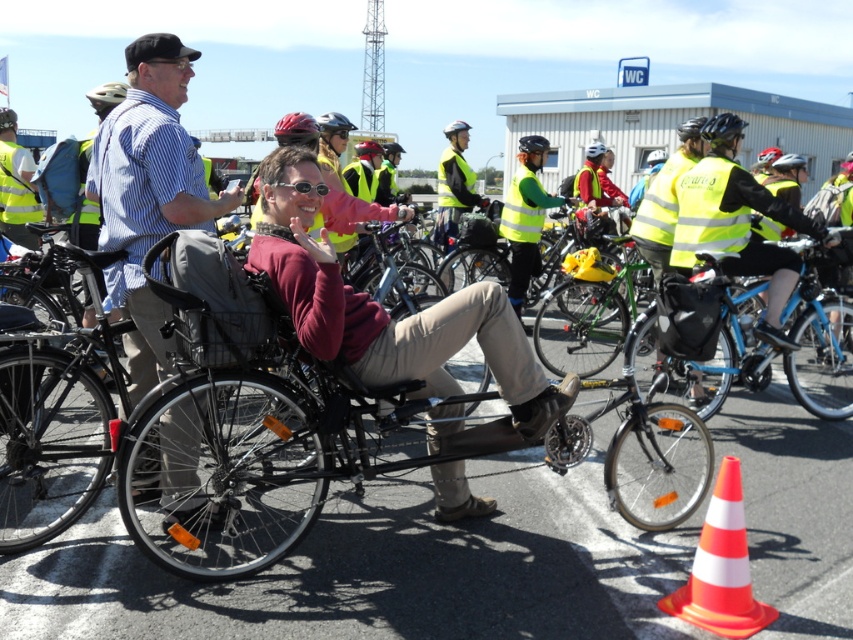
Is black matte bicycle at center smaller than blue striped shirt at center?

Incorrect, black matte bicycle at center is not smaller in size than blue striped shirt at center.

The width and height of the screenshot is (853, 640). Identify the location of black matte bicycle at center. (200, 449).

Does yellow reflective safety vest at upper left have a larger size compared to sunglasses at center?

Yes, yellow reflective safety vest at upper left is bigger than sunglasses at center.

Is point (15, 205) positioned behind point (302, 186)?

Yes.

Who is more distant from viewer, (30, 161) or (282, 186)?

Point (30, 161)

Locate an element on the screen. The width and height of the screenshot is (853, 640). yellow reflective safety vest at upper left is located at coordinates (16, 186).

Can you confirm if blue metallic bicycle at center-right is positioned to the left of orange/white plastic traffic cone at lower right?

No, blue metallic bicycle at center-right is not to the left of orange/white plastic traffic cone at lower right.

Is point (815, 250) positioned before point (741, 515)?

That is False.

Is point (729, 353) positioned after point (703, 522)?

Yes, it is behind point (703, 522).

You are a GUI agent. You are given a task and a screenshot of the screen. Output one action in this format:
    pyautogui.click(x=<x>, y=<y>)
    Task: Click on the blue metallic bicycle at center-right
    This screenshot has height=640, width=853.
    Given the screenshot: What is the action you would take?
    pyautogui.click(x=792, y=330)